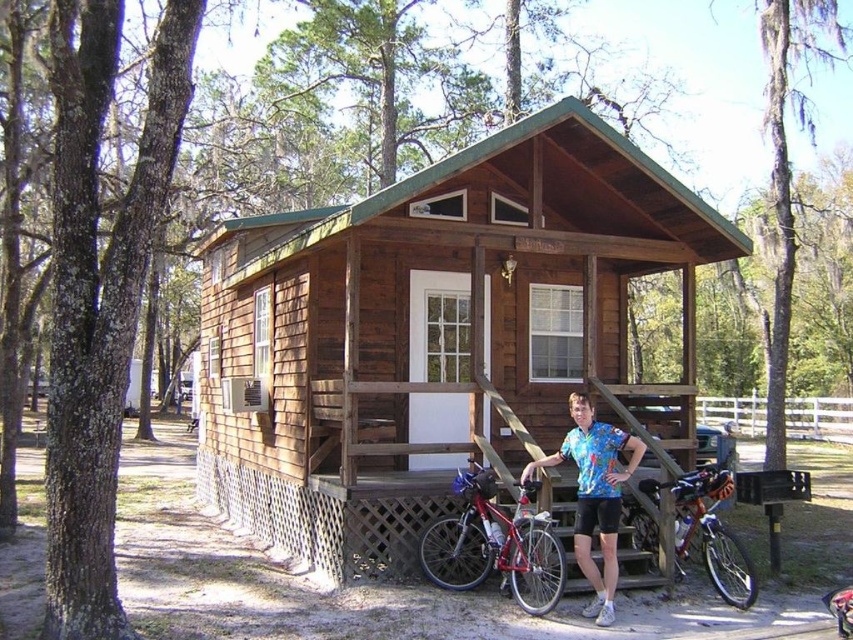
You are standing in front of the brown wooden cabin at center and looking at the blue printed shirt at center. Which object is taller?

The blue printed shirt at center is taller than the brown wooden cabin at center.

You are standing in front of the cabin and want to take a photo that includes both the red bicycle and the blue bicycle. The red bicycle is at point (251, 259) and the blue bicycle is at point (503, 531). Which bicycle is closer to the camera so that it appears larger in the photo?

The red bicycle at point (251, 259) is closer to the camera than the blue bicycle at point (503, 531), so it will appear larger in the photo.

You are standing in front of the brown wooden cabin at center and notice a blue printed shirt at center nearby. Can you tell me which object is positioned higher from the ground?

The brown wooden cabin at center is located above the blue printed shirt at center, so the cabin is higher up.